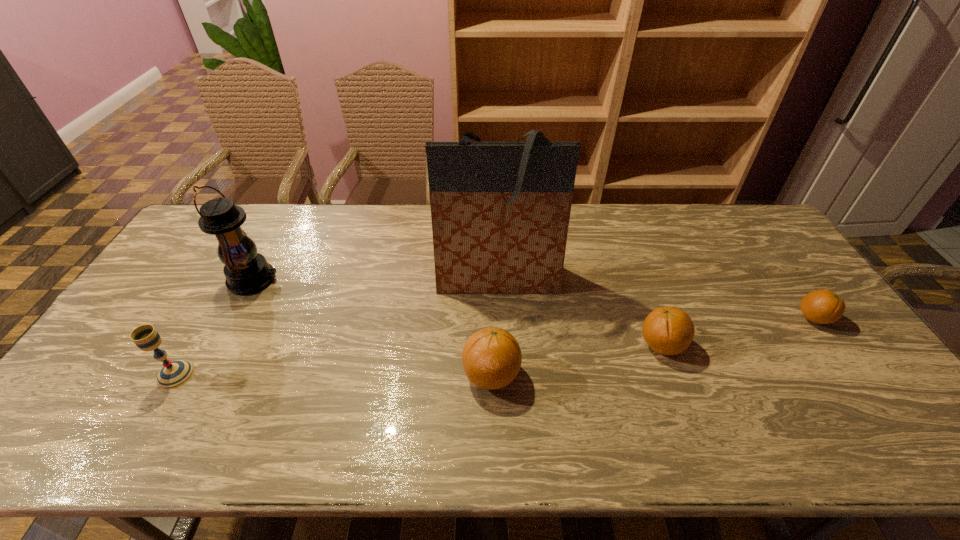
You are a GUI agent. You are given a task and a screenshot of the screen. Output one action in this format:
    pyautogui.click(x=<x>, y=<y>)
    Task: Click on the vacant position in the image that satisfies the following two spatial constraints: 1. above the lantern, indicating its light source; 2. on the right side of the leftmost orange
    The width and height of the screenshot is (960, 540).
    Given the screenshot: What is the action you would take?
    pyautogui.click(x=204, y=375)

The image size is (960, 540). Find the location of `vacant area in the image that satisfies the following two spatial constraints: 1. on the front side of the fourth tallest object; 2. on the left side of the chalice`. vacant area in the image that satisfies the following two spatial constraints: 1. on the front side of the fourth tallest object; 2. on the left side of the chalice is located at coordinates (176, 375).